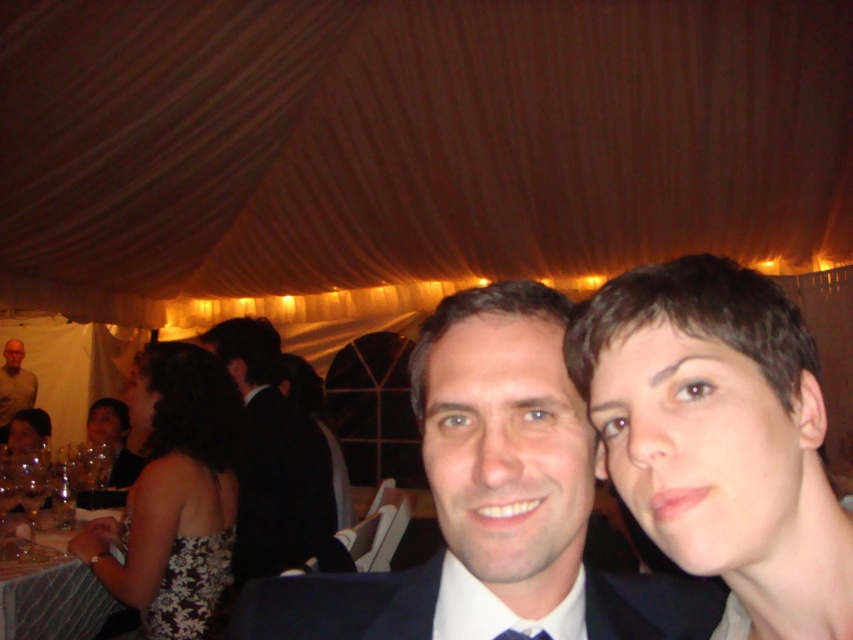
Question: Does black satin dress at lower left lie in front of blue silk tie at center?

Choices:
 (A) no
 (B) yes

Answer: (A)

Question: Considering the relative positions of black satin dress at lower left and white glossy table at lower left in the image provided, where is black satin dress at lower left located with respect to white glossy table at lower left?

Choices:
 (A) right
 (B) left

Answer: (A)

Question: Which point is farther to the camera?

Choices:
 (A) black floral dress at lower left
 (B) light brown shirt at left

Answer: (B)

Question: Is matte black suit at center smaller than black satin dress at lower left?

Choices:
 (A) yes
 (B) no

Answer: (A)

Question: Which point is closer to the camera taking this photo?

Choices:
 (A) pos(328,513)
 (B) pos(650,403)

Answer: (B)

Question: Which point is farther to the camera?

Choices:
 (A) black floral dress at lower left
 (B) short hair at center
 (C) light brown shirt at left

Answer: (C)